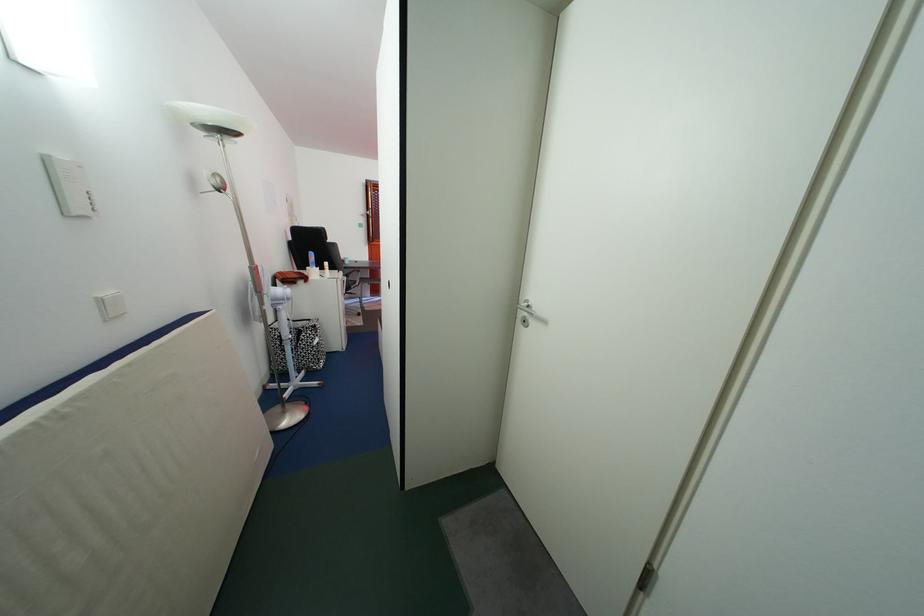
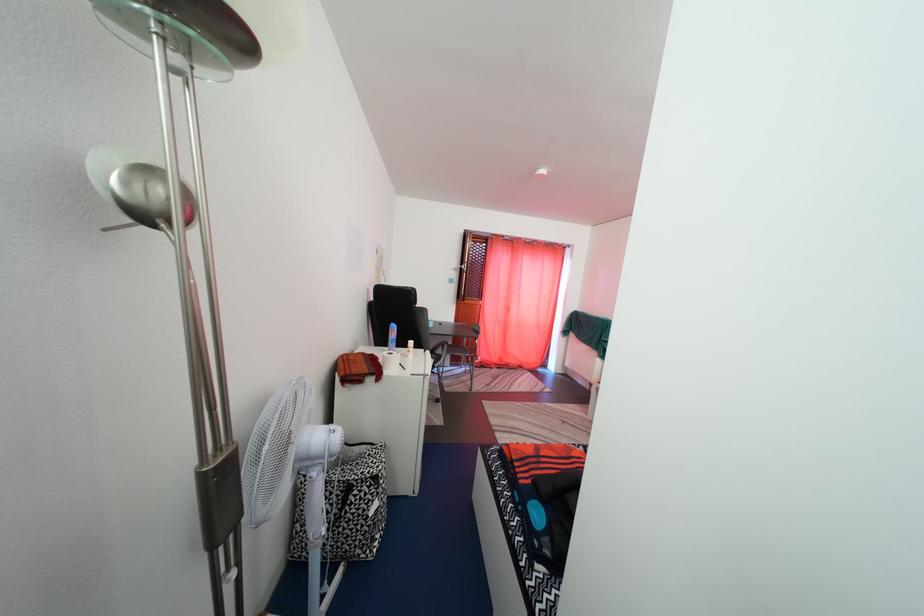
Locate, in the second image, the point that corresponds to point (349, 278) in the first image.

(436, 359)